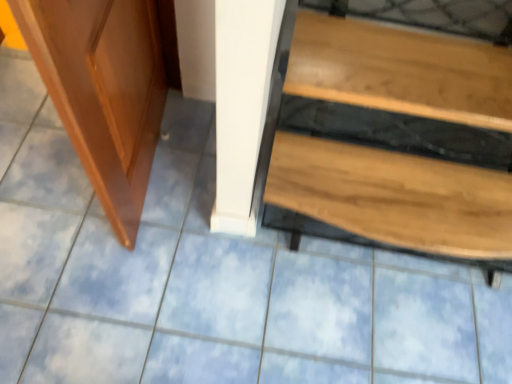
Locate an element on the screen. This screenshot has width=512, height=384. free space in front of wooden table at lower right is located at coordinates (370, 331).